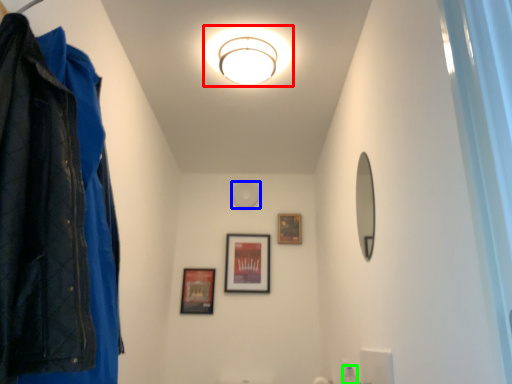
Question: Which object is positioned farthest from light fixture (highlighted by a red box)? Select from light (highlighted by a blue box) and toiletry (highlighted by a green box).

Choices:
 (A) light
 (B) toiletry

Answer: (B)